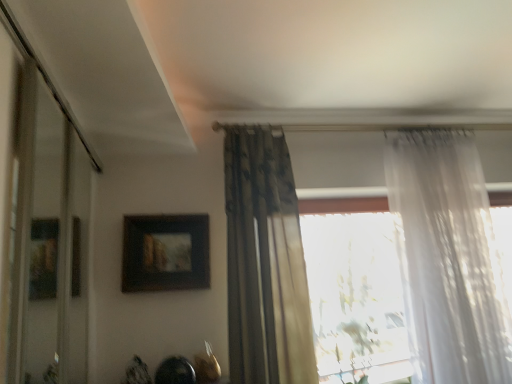
Question: Considering the relative sizes of transparent glass door at left and dark floral fabric curtain at center, which appears as the first curtain when viewed from the left, in the image provided, is transparent glass door at left thinner than dark floral fabric curtain at center, which appears as the first curtain when viewed from the left,?

Choices:
 (A) yes
 (B) no

Answer: (A)

Question: Does transparent glass door at left have a greater height compared to dark floral fabric curtain at center, the second curtain positioned from the right?

Choices:
 (A) yes
 (B) no

Answer: (B)

Question: Does transparent glass door at left appear on the right side of dark floral fabric curtain at center, which appears as the first curtain when viewed from the left?

Choices:
 (A) no
 (B) yes

Answer: (A)

Question: From the image's perspective, is transparent glass door at left located beneath dark floral fabric curtain at center, the second curtain positioned from the right?

Choices:
 (A) no
 (B) yes

Answer: (A)

Question: From a real-world perspective, is transparent glass door at left positioned under dark floral fabric curtain at center, which appears as the first curtain when viewed from the left, based on gravity?

Choices:
 (A) no
 (B) yes

Answer: (B)

Question: In terms of height, does transparent glass door at left look taller or shorter compared to matte black picture frame at upper center?

Choices:
 (A) short
 (B) tall

Answer: (B)

Question: From the image's perspective, is transparent glass door at left above or below matte black picture frame at upper center?

Choices:
 (A) above
 (B) below

Answer: (A)

Question: Is point (32, 130) closer or farther from the camera than point (169, 261)?

Choices:
 (A) farther
 (B) closer

Answer: (B)

Question: In the image, is transparent glass door at left on the left side or the right side of matte black picture frame at upper center?

Choices:
 (A) right
 (B) left

Answer: (B)

Question: From their relative heights in the image, would you say matte black picture frame at upper center is taller or shorter than transparent glass door at left?

Choices:
 (A) tall
 (B) short

Answer: (B)

Question: From a real-world perspective, is matte black picture frame at upper center physically located above or below transparent glass door at left?

Choices:
 (A) above
 (B) below

Answer: (A)

Question: Is matte black picture frame at upper center bigger or smaller than transparent glass door at left?

Choices:
 (A) big
 (B) small

Answer: (B)

Question: Is matte black picture frame at upper center to the left or to the right of transparent glass door at left in the image?

Choices:
 (A) right
 (B) left

Answer: (A)

Question: Is point (x=403, y=286) positioned closer to the camera than point (x=142, y=223)?

Choices:
 (A) farther
 (B) closer

Answer: (A)

Question: In terms of height, does sheer white curtain at right, the 2th curtain in the left-to-right sequence, look taller or shorter compared to matte black picture frame at upper center?

Choices:
 (A) tall
 (B) short

Answer: (A)